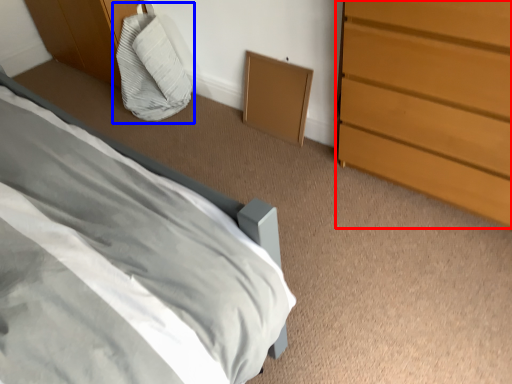
Question: Which point is further to the camera, chest of drawers (highlighted by a red box) or bean bag chair (highlighted by a blue box)?

Choices:
 (A) chest of drawers
 (B) bean bag chair

Answer: (B)